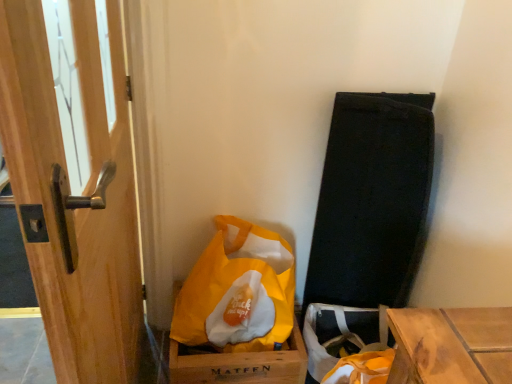
Question: From a real-world perspective, is wooden door handle at left physically below yellow matte cardboard box at lower center?

Choices:
 (A) no
 (B) yes

Answer: (A)

Question: Considering the relative positions of wooden door handle at left and yellow matte cardboard box at lower center in the image provided, is wooden door handle at left to the left of yellow matte cardboard box at lower center from the viewer's perspective?

Choices:
 (A) no
 (B) yes

Answer: (B)

Question: Is wooden door handle at left far away from yellow matte cardboard box at lower center?

Choices:
 (A) no
 (B) yes

Answer: (A)

Question: Does wooden door handle at left have a lesser width compared to yellow matte cardboard box at lower center?

Choices:
 (A) yes
 (B) no

Answer: (A)

Question: Can you confirm if wooden door handle at left is shorter than yellow matte cardboard box at lower center?

Choices:
 (A) no
 (B) yes

Answer: (A)

Question: Is wooden door handle at left touching yellow matte cardboard box at lower center?

Choices:
 (A) yes
 (B) no

Answer: (B)

Question: From the image's perspective, would you say yellow matte cardboard box at lower center is shown under yellow fabric bag at lower center?

Choices:
 (A) yes
 (B) no

Answer: (A)

Question: Are yellow matte cardboard box at lower center and yellow fabric bag at lower center far apart?

Choices:
 (A) yes
 (B) no

Answer: (B)

Question: Is yellow fabric bag at lower center located within yellow matte cardboard box at lower center?

Choices:
 (A) yes
 (B) no

Answer: (B)

Question: Considering the relative positions of yellow matte cardboard box at lower center and yellow fabric bag at lower center in the image provided, is yellow matte cardboard box at lower center behind yellow fabric bag at lower center?

Choices:
 (A) yes
 (B) no

Answer: (A)

Question: Considering the relative positions of yellow matte cardboard box at lower center and yellow fabric bag at lower center in the image provided, is yellow matte cardboard box at lower center to the right of yellow fabric bag at lower center from the viewer's perspective?

Choices:
 (A) no
 (B) yes

Answer: (A)

Question: From the image's perspective, is yellow matte cardboard box at lower center on yellow fabric bag at lower center?

Choices:
 (A) yes
 (B) no

Answer: (B)

Question: From the image's perspective, is yellow matte cardboard box at lower center on top of wooden door handle at left?

Choices:
 (A) no
 (B) yes

Answer: (A)